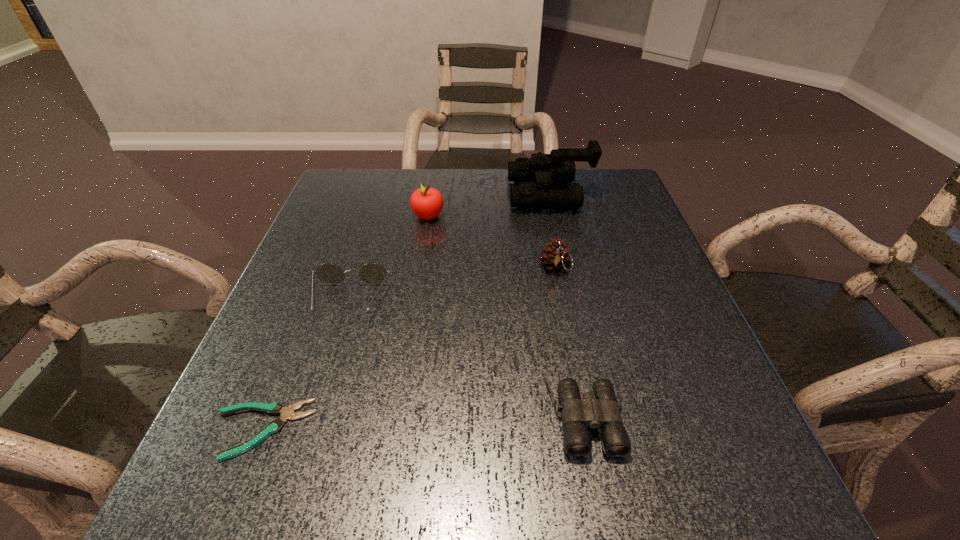
Identify the location of free space between the shortest object and the fourth nearest object. (409, 349).

This screenshot has width=960, height=540. I want to click on free space between the nearer binoculars and the second tallest object, so click(x=503, y=304).

Locate an element on the screen. This screenshot has height=540, width=960. object that is the fifth closest to the spectacles is located at coordinates (559, 166).

Find the location of a particular element. This screenshot has height=540, width=960. object that is the closest one to the fourth tallest object is located at coordinates (275, 408).

At what (x,y) coordinates should I click in order to perform the action: click on free space that satisfies the following two spatial constraints: 1. on the front lenses of the taller binoculars; 2. on the front side of the fourth object from right to left. Please return your answer as a coordinate pair (x, y). This screenshot has width=960, height=540. Looking at the image, I should click on (555, 216).

Locate an element on the screen. vacant space that satisfies the following two spatial constraints: 1. on the front lenses of the farther binoculars; 2. on the front-facing side of the fourth tallest object is located at coordinates (574, 302).

Where is `free space in the image that satisfies the following two spatial constraints: 1. on the front lenses of the taller binoculars; 2. on the front side of the apple`? This screenshot has width=960, height=540. free space in the image that satisfies the following two spatial constraints: 1. on the front lenses of the taller binoculars; 2. on the front side of the apple is located at coordinates (555, 216).